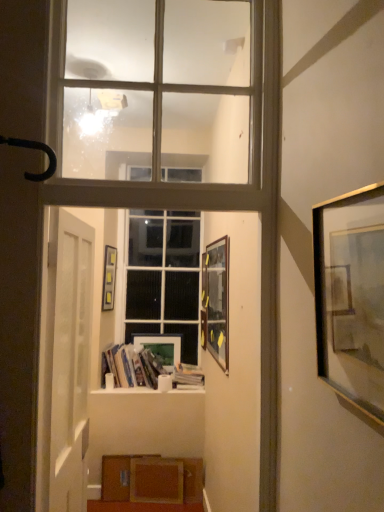
Measure the distance between wooden picture frame at center, which ranks as the third picture frame in left-to-right order, and camera.

wooden picture frame at center, which ranks as the third picture frame in left-to-right order, and camera are 2.13 meters apart.

In the scene shown: What is the approximate width of hardcover books at center, placed as the 2th book when sorted from right to left?

It is 12.55 inches.

Measure the distance between point (105, 259) and camera.

The distance of point (105, 259) from camera is 3.32 meters.

Consider the image. What is the approximate height of matte plastic picture frame at upper center, marked as the second picture frame in a back-to-front arrangement?

21.06 inches.

How much space does white glass window at center, placed as the 2th window when sorted from top to bottom, occupy horizontally?

It is 13.43 centimeters.

What do you see at coordinates (71, 362) in the screenshot? The image size is (384, 512). I see `white matte door at left` at bounding box center [71, 362].

This screenshot has height=512, width=384. I want to click on clear glass window at upper center, the 2th window when ordered from back to front, so click(x=182, y=86).

From the image's perspective, count 2nd picture frames upward from the white glass window at center, placed as the 2th window when sorted from top to bottom, and point to it. Please provide its 2D coordinates.

[(351, 296)]

Is gold metallic picture frame at right, positioned as the 1th picture frame in front-to-back order, oriented towards white glass window at center, placed as the 2th window when sorted from top to bottom?

No, gold metallic picture frame at right, positioned as the 1th picture frame in front-to-back order, is not turned towards white glass window at center, placed as the 2th window when sorted from top to bottom.

From the image's perspective, is gold metallic picture frame at right, positioned as the 1th picture frame in front-to-back order, over white glass window at center, acting as the 1th window starting from the back?

Yes.

Between gold metallic picture frame at right, positioned as the 1th picture frame in front-to-back order, and white glass window at center, acting as the 1th window starting from the back, which one has smaller size?

gold metallic picture frame at right, positioned as the 1th picture frame in front-to-back order.

Consider the image. Considering the relative sizes of gold metallic picture frame at right, the 4th picture frame viewed from the left, and matte plastic picture frame at upper center, which appears as the fourth picture frame when viewed from the right, in the image provided, is gold metallic picture frame at right, the 4th picture frame viewed from the left, thinner than matte plastic picture frame at upper center, which appears as the fourth picture frame when viewed from the right,?

Incorrect, the width of gold metallic picture frame at right, the 4th picture frame viewed from the left, is not less than that of matte plastic picture frame at upper center, which appears as the fourth picture frame when viewed from the right.

Considering the positions of point (358, 305) and point (114, 256), is point (358, 305) closer or farther from the camera than point (114, 256)?

Point (358, 305) is positioned closer to the camera compared to point (114, 256).

From a real-world perspective, is gold metallic picture frame at right, marked as the 1th picture frame in a right-to-left arrangement, physically located above or below matte plastic picture frame at upper center, acting as the 3th picture frame starting from the front?

gold metallic picture frame at right, marked as the 1th picture frame in a right-to-left arrangement, is situated higher than matte plastic picture frame at upper center, acting as the 3th picture frame starting from the front, in the real world.

Who is shorter, gold metallic picture frame at right, positioned as the 1th picture frame in front-to-back order, or matte plastic picture frame at upper center, acting as the 3th picture frame starting from the front?

With less height is gold metallic picture frame at right, positioned as the 1th picture frame in front-to-back order.

Between wooden picture frame at center, which ranks as the third picture frame in left-to-right order, and clear glass window at upper center, which is the 1th window in top-to-bottom order, which one has smaller width?

With smaller width is wooden picture frame at center, which ranks as the third picture frame in left-to-right order.

From a real-world perspective, which is physically below, wooden picture frame at center, the 2th picture frame in the right-to-left sequence, or clear glass window at upper center, which appears as the second window when ordered from the bottom?

In real-world perspective, wooden picture frame at center, the 2th picture frame in the right-to-left sequence, is lower.

From the image's perspective, which picture frame is the 3rd one below the clear glass window at upper center, which is counted as the 1th window, starting from the front? Please provide its 2D coordinates.

[(216, 301)]

From a real-world perspective, is matte plastic picture frame at upper center, acting as the 3th picture frame starting from the front, positioned over white glass window at center, positioned as the 2th window in front-to-back order, based on gravity?

Indeed, from a real-world perspective, matte plastic picture frame at upper center, acting as the 3th picture frame starting from the front, stands above white glass window at center, positioned as the 2th window in front-to-back order.

Between matte plastic picture frame at upper center, positioned as the 1th picture frame in left-to-right order, and white glass window at center, the first window in the bottom-to-top sequence, which one is positioned behind?

white glass window at center, the first window in the bottom-to-top sequence, is behind.

Identify the location of window below the matte plastic picture frame at upper center, marked as the second picture frame in a back-to-front arrangement (from a real-world perspective). The width and height of the screenshot is (384, 512). (164, 276).

Is white glass window at center, positioned as the 2th window in front-to-back order, located within matte plastic picture frame at upper center, positioned as the 1th picture frame in left-to-right order?

No, matte plastic picture frame at upper center, positioned as the 1th picture frame in left-to-right order, does not contain white glass window at center, positioned as the 2th window in front-to-back order.

Could you tell me if wooden picture frame at center, placed as the second picture frame when sorted from front to back, is turned towards hardcover books at center, placed as the 2th book when sorted from right to left?

No, wooden picture frame at center, placed as the second picture frame when sorted from front to back, is not turned towards hardcover books at center, placed as the 2th book when sorted from right to left.

Is the depth of wooden picture frame at center, the 2th picture frame in the right-to-left sequence, greater than that of hardcover books at center, the first book in the left-to-right sequence?

No, wooden picture frame at center, the 2th picture frame in the right-to-left sequence, is in front of hardcover books at center, the first book in the left-to-right sequence.

How many degrees apart are the facing directions of wooden picture frame at center, the third picture frame positioned from the back, and hardcover books at center, the first book in the left-to-right sequence?

The angular difference between wooden picture frame at center, the third picture frame positioned from the back, and hardcover books at center, the first book in the left-to-right sequence, is 89 degrees.

Looking at their sizes, would you say wooden picture frame at center, the third picture frame positioned from the back, is wider or thinner than hardcover books at center, placed as the 2th book when sorted from right to left?

wooden picture frame at center, the third picture frame positioned from the back, is thinner than hardcover books at center, placed as the 2th book when sorted from right to left.

Where is `book that is the 2nd object located behind the gold metallic picture frame at right, which is the 4th picture frame from back to front`? This screenshot has height=512, width=384. book that is the 2nd object located behind the gold metallic picture frame at right, which is the 4th picture frame from back to front is located at coordinates (187, 377).

Looking at this image, which of these two, white paper stack at center, the first book positioned from the right, or gold metallic picture frame at right, the 4th picture frame viewed from the left, is smaller?

gold metallic picture frame at right, the 4th picture frame viewed from the left.

Between clear glass window at upper center, which is the 1th window in top-to-bottom order, and gold metallic picture frame at right, the 4th picture frame viewed from the left, which one has more height?

clear glass window at upper center, which is the 1th window in top-to-bottom order, is taller.

Which point is more forward, [111,138] or [322,246]?

Positioned in front is point [322,246].

Is clear glass window at upper center, which is counted as the 1th window, starting from the front, far away from gold metallic picture frame at right, which is the 4th picture frame from back to front?

Absolutely, clear glass window at upper center, which is counted as the 1th window, starting from the front, is distant from gold metallic picture frame at right, which is the 4th picture frame from back to front.

Where is `the 2nd picture frame positioned above the white glass window at center, acting as the 1th window starting from the back (from a real-world perspective)`? The image size is (384, 512). the 2nd picture frame positioned above the white glass window at center, acting as the 1th window starting from the back (from a real-world perspective) is located at coordinates [351, 296].

Where is `picture frame that is the 3rd object to the left of the gold metallic picture frame at right, which is the 4th picture frame from back to front, starting at the anchor`? picture frame that is the 3rd object to the left of the gold metallic picture frame at right, which is the 4th picture frame from back to front, starting at the anchor is located at coordinates click(109, 278).

Based on their spatial positions, is white paper stack at center, the first book positioned from the right, or matte wooden picture frame at center, arranged as the third picture frame when viewed from the right, closer to matte plastic picture frame at upper center, positioned as the 1th picture frame in left-to-right order?

matte wooden picture frame at center, arranged as the third picture frame when viewed from the right, is positioned closer to the anchor matte plastic picture frame at upper center, positioned as the 1th picture frame in left-to-right order.

Looking at the image, which one is located further to matte wooden picture frame at center, positioned as the 4th picture frame in front-to-back order, white paper stack at center, the first book positioned from the right, or clear glass window at upper center, which appears as the second window when ordered from the bottom?

Based on the image, clear glass window at upper center, which appears as the second window when ordered from the bottom, appears to be further to matte wooden picture frame at center, positioned as the 4th picture frame in front-to-back order.

Looking at the image, which one is located closer to matte plastic picture frame at upper center, which appears as the fourth picture frame when viewed from the right, white glass window at center, positioned as the 2th window in front-to-back order, or white matte door at left?

Based on the image, white glass window at center, positioned as the 2th window in front-to-back order, appears to be nearer to matte plastic picture frame at upper center, which appears as the fourth picture frame when viewed from the right.

Estimate the real-world distances between objects in this image. Which object is further from wooden picture frame at center, the third picture frame positioned from the back, gold metallic picture frame at right, which is the 4th picture frame from back to front, or clear glass window at upper center, which is counted as the 1th window, starting from the front?

gold metallic picture frame at right, which is the 4th picture frame from back to front, lies further to wooden picture frame at center, the third picture frame positioned from the back, than the other object.

Considering their positions, is gold metallic picture frame at right, which is the 4th picture frame from back to front, positioned further to hardcover books at center, placed as the 2th book when sorted from right to left, than matte plastic picture frame at upper center, which appears as the fourth picture frame when viewed from the right?

gold metallic picture frame at right, which is the 4th picture frame from back to front, is positioned further to the anchor hardcover books at center, placed as the 2th book when sorted from right to left.

Considering their positions, is white glass window at center, placed as the 2th window when sorted from top to bottom, positioned closer to gold metallic picture frame at right, marked as the 1th picture frame in a right-to-left arrangement, than hardcover books at center, placed as the 2th book when sorted from right to left?

Among the two, hardcover books at center, placed as the 2th book when sorted from right to left, is located nearer to gold metallic picture frame at right, marked as the 1th picture frame in a right-to-left arrangement.

Which object lies further to the anchor point hardcover books at center, placed as the 2th book when sorted from right to left, white paper stack at center, the second book from the left, or white matte door at left?

white matte door at left lies further to hardcover books at center, placed as the 2th book when sorted from right to left, than the other object.

Considering their positions, is clear glass window at upper center, which is counted as the 1th window, starting from the front, positioned closer to wooden picture frame at center, placed as the second picture frame when sorted from front to back, than matte wooden picture frame at center, the 1th picture frame viewed from the back?

clear glass window at upper center, which is counted as the 1th window, starting from the front.

The height and width of the screenshot is (512, 384). Identify the location of picture frame between white matte door at left and matte plastic picture frame at upper center, positioned as the 1th picture frame in left-to-right order, along the z-axis. (216, 301).

At what (x,y) coordinates should I click in order to perform the action: click on door between clear glass window at upper center, the 2th window when ordered from back to front, and white glass window at center, positioned as the 2th window in front-to-back order, along the z-axis. Please return your answer as a coordinate pair (x, y). Image resolution: width=384 pixels, height=512 pixels. Looking at the image, I should click on (71, 362).

Find the location of a particular element. window positioned between gold metallic picture frame at right, which is the 4th picture frame from back to front, and matte plastic picture frame at upper center, positioned as the 1th picture frame in left-to-right order, from near to far is located at coordinates (182, 86).

This screenshot has height=512, width=384. I want to click on picture frame between wooden picture frame at center, the third picture frame positioned from the back, and white glass window at center, positioned as the 2th window in front-to-back order, in the front-back direction, so point(109,278).